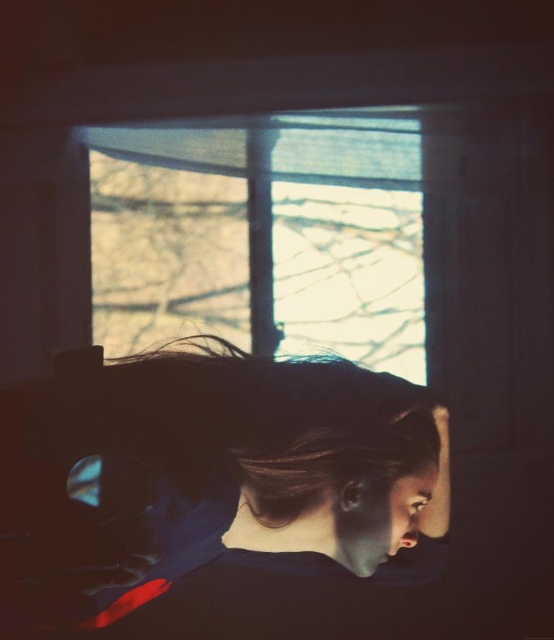
From the picture: You are a photographer trying to capture the winter scene outside the translucent glass window at upper center. You notice the person with matte black hair at center is blocking your view. Can you move the person to the side to get a clear shot of the window?

The matte black hair at center is closer to the viewer than the translucent glass window at upper center, so moving the person would allow you to capture the window without obstruction.

You are a photographer trying to capture a portrait of the person with the matte black hair at center. The translucent glass window at upper center is reflecting some light. To reduce glare from the window, should you move closer to or farther away from the person?

Since the matte black hair at center is only 14.16 centimeters away from the translucent glass window at upper center, moving closer to the person would decrease the distance between the camera and the window, potentially increasing glare. Therefore, to reduce glare, you should move farther away from the person to increase the distance from the window.

You are a photographer trying to capture the winter scene outside the translucent glass window at upper center. You notice the matte black hair at center in your shot. Based on their positions, can you determine if the hair will block the view of the window in your photo?

The matte black hair at center is below the translucent glass window at upper center, so it will not block the view of the window in your photo.